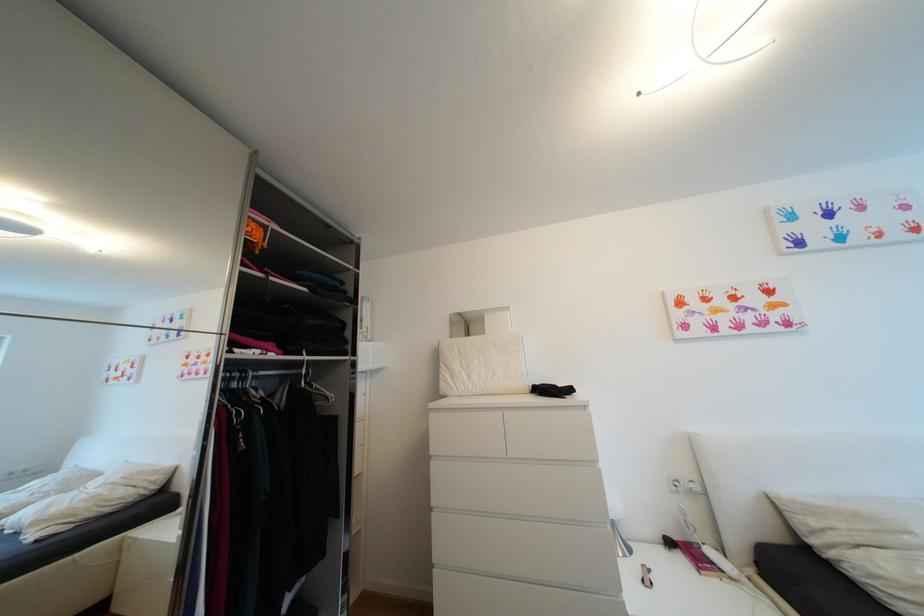
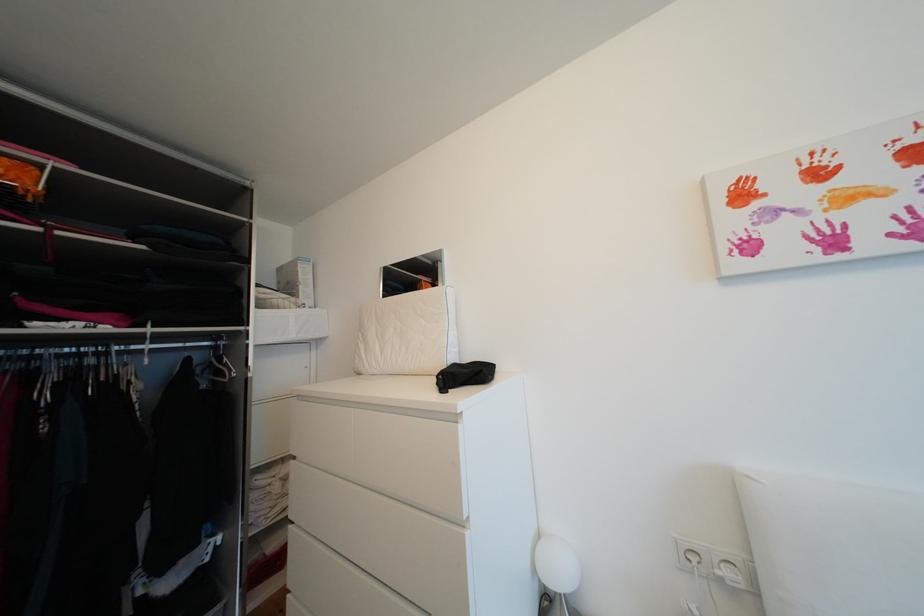
Question: The first image is from the beginning of the video and the second image is from the end. How did the camera likely rotate when shooting the video?

Choices:
 (A) Left
 (B) Right
 (C) Up
 (D) Down

Answer: (A)